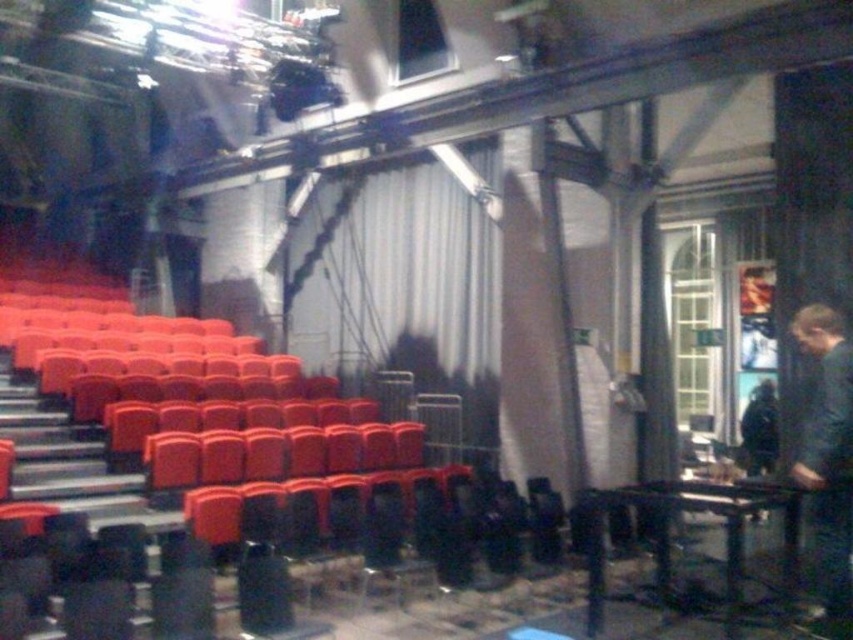
Question: Can you confirm if white matte curtain at center is bigger than dark blue fabric at right?

Choices:
 (A) no
 (B) yes

Answer: (B)

Question: Which of the following is the farthest from the observer?

Choices:
 (A) (840, 326)
 (B) (438, 364)

Answer: (B)

Question: Does white matte curtain at center appear over dark blue fabric at right?

Choices:
 (A) no
 (B) yes

Answer: (B)

Question: Which point is farther to the camera?

Choices:
 (A) dark blue fabric at right
 (B) white matte curtain at center

Answer: (B)

Question: Is white matte curtain at center positioned before dark blue fabric at right?

Choices:
 (A) yes
 (B) no

Answer: (B)